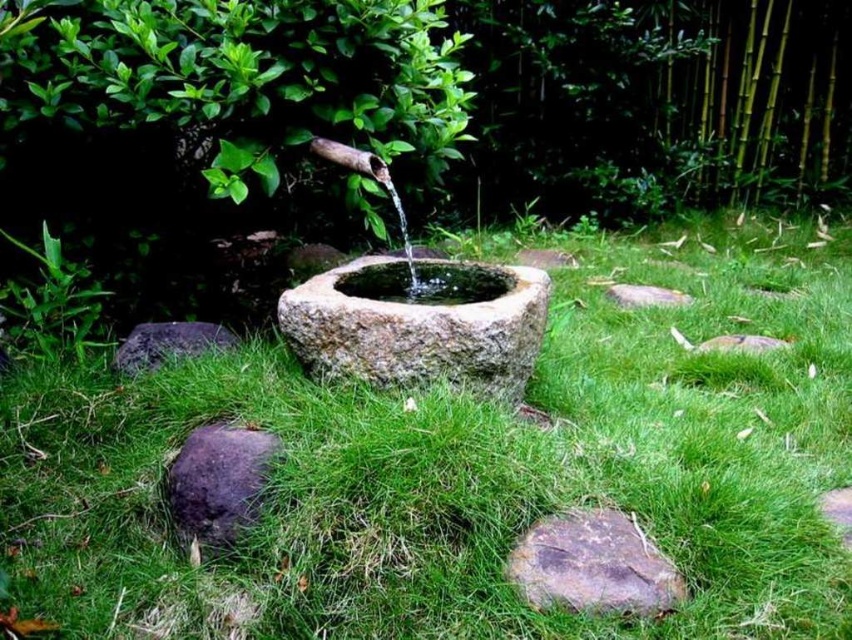
How far apart are brown rough rock at lower left and clear water at center?

A distance of 1.29 meters exists between brown rough rock at lower left and clear water at center.

Who is more forward, (271, 444) or (417, 291)?

Point (271, 444) is in front.

The width and height of the screenshot is (852, 640). Find the location of `brown rough rock at lower left`. brown rough rock at lower left is located at coordinates (217, 481).

Does green grass at center lie behind smooth stone fountain at center?

No, green grass at center is closer to the viewer.

Is green grass at center to the left of smooth stone fountain at center from the viewer's perspective?

Incorrect, green grass at center is not on the left side of smooth stone fountain at center.

Is point (492, 240) behind point (384, 346)?

Yes, it is.

You are a GUI agent. You are given a task and a screenshot of the screen. Output one action in this format:
    pyautogui.click(x=<x>, y=<y>)
    Task: Click on the green grass at center
    This screenshot has width=852, height=640.
    Given the screenshot: What is the action you would take?
    pyautogui.click(x=467, y=467)

Is brown rough rock at lower left smaller than smooth gray stone at center?

No.

Identify the location of brown rough rock at lower left. (217, 481).